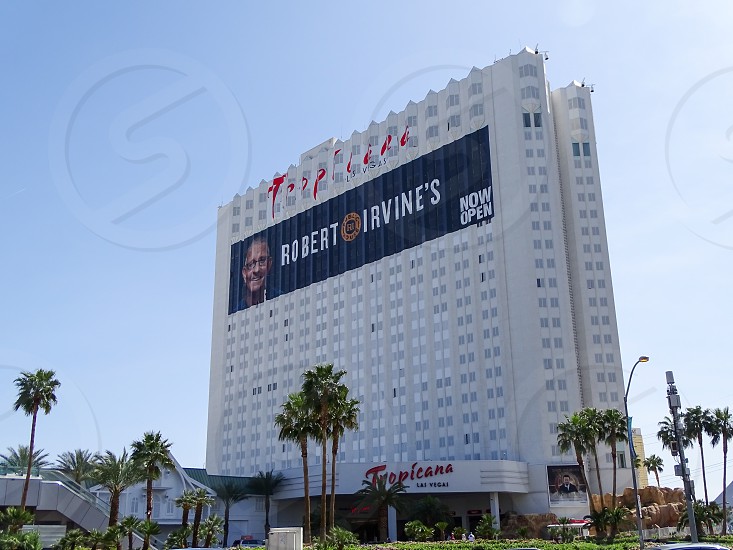
Locate an element on the screen. This screenshot has height=550, width=733. hotel is located at coordinates (520, 289).